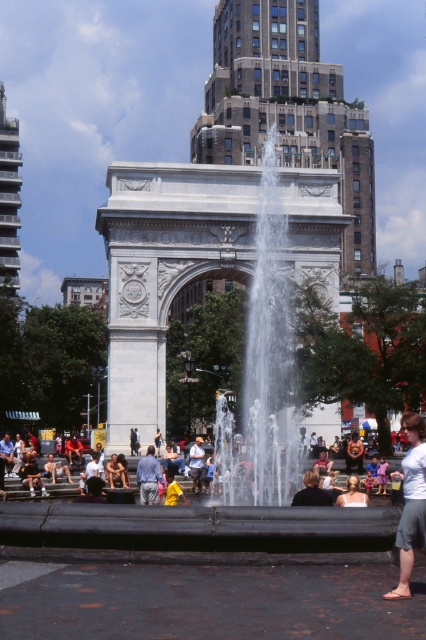
Is point (13, 204) positioned after point (52, 493)?

Yes, it is.

Is smooth concrete tower at left in front of light brown leather jacket at lower center?

No, it is behind light brown leather jacket at lower center.

Does point (13, 188) lie behind point (305, 467)?

Yes.

At what (x,y) coordinates should I click in order to perform the action: click on smooth concrete tower at left. Please return your answer as a coordinate pair (x, y). Looking at the image, I should click on [x=8, y=204].

Who is taller, white marble fountain at center or brown stone arch at center?

With more height is brown stone arch at center.

Is point (172, 230) farther from viewer compared to point (244, 22)?

No, it is not.

Where is `white marble fountain at center`? Image resolution: width=426 pixels, height=640 pixels. white marble fountain at center is located at coordinates (198, 257).

The height and width of the screenshot is (640, 426). What do you see at coordinates (8, 204) in the screenshot? I see `smooth concrete tower at left` at bounding box center [8, 204].

Is smooth concrete tower at left to the right of light blue denim jacket at center from the viewer's perspective?

In fact, smooth concrete tower at left is to the left of light blue denim jacket at center.

Image resolution: width=426 pixels, height=640 pixels. What do you see at coordinates (8, 204) in the screenshot? I see `smooth concrete tower at left` at bounding box center [8, 204].

Locate an element on the screen. smooth concrete tower at left is located at coordinates (8, 204).